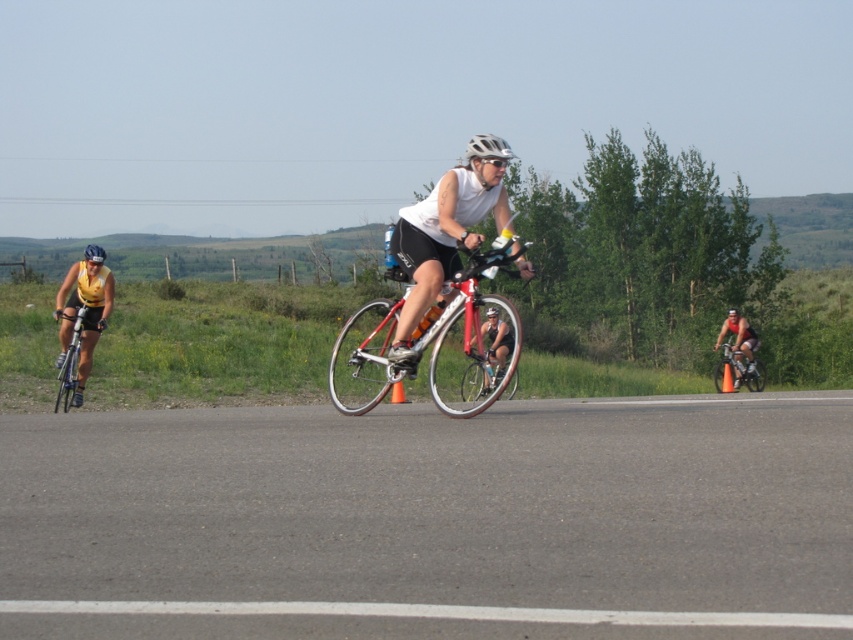
Question: Does shiny metallic bicycle at center appear on the left side of shiny silver bicycle at left?

Choices:
 (A) yes
 (B) no

Answer: (B)

Question: Which point is farther from the camera taking this photo?

Choices:
 (A) (759, 372)
 (B) (84, 259)

Answer: (A)

Question: Does shiny metallic bicycle at center have a greater width compared to shiny silver bicycle at right?

Choices:
 (A) yes
 (B) no

Answer: (A)

Question: Which object is the closest to the matte white helmet at center?

Choices:
 (A) shiny silver bicycle at right
 (B) white matte helmet at center
 (C) shiny silver bicycle at left
 (D) blue matte bicycle helmet at left

Answer: (C)

Question: Estimate the real-world distances between objects in this image. Which object is farther from the shiny silver bicycle at right?

Choices:
 (A) shiny silver bicycle at left
 (B) white matte helmet at center

Answer: (B)

Question: Does white matte helmet at center appear on the left side of blue matte bicycle helmet at left?

Choices:
 (A) no
 (B) yes

Answer: (A)